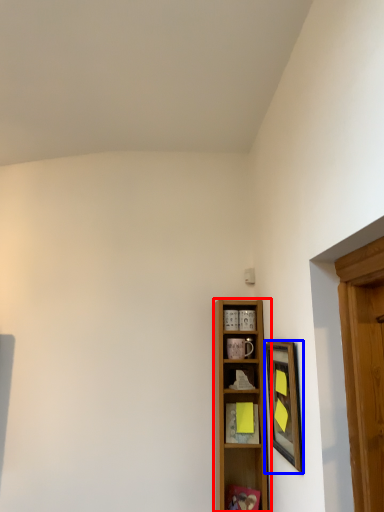
Question: Which object appears closest to the camera in this image, shelf (highlighted by a red box) or picture frame (highlighted by a blue box)?

Choices:
 (A) shelf
 (B) picture frame

Answer: (B)